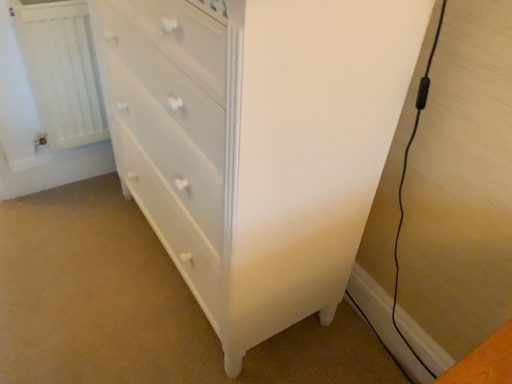
Question: Is white painted wood chest of drawers at center oriented away from white painted radiator at left?

Choices:
 (A) no
 (B) yes

Answer: (A)

Question: Could you tell me if white painted wood chest of drawers at center is turned towards white painted radiator at left?

Choices:
 (A) no
 (B) yes

Answer: (A)

Question: Can you confirm if white painted wood chest of drawers at center is smaller than white painted radiator at left?

Choices:
 (A) no
 (B) yes

Answer: (A)

Question: Does white painted wood chest of drawers at center appear on the right side of white painted radiator at left?

Choices:
 (A) no
 (B) yes

Answer: (B)

Question: Is white painted wood chest of drawers at center in contact with white painted radiator at left?

Choices:
 (A) no
 (B) yes

Answer: (A)

Question: Is white painted wood chest of drawers at center positioned behind white painted radiator at left?

Choices:
 (A) no
 (B) yes

Answer: (A)

Question: Considering the relative sizes of white painted radiator at left and white painted wood chest of drawers at center in the image provided, is white painted radiator at left smaller than white painted wood chest of drawers at center?

Choices:
 (A) no
 (B) yes

Answer: (B)

Question: Can you confirm if white painted radiator at left is thinner than white painted wood chest of drawers at center?

Choices:
 (A) no
 (B) yes

Answer: (B)

Question: Is white painted radiator at left at the left side of white painted wood chest of drawers at center?

Choices:
 (A) yes
 (B) no

Answer: (A)

Question: From a real-world perspective, is white painted radiator at left on white painted wood chest of drawers at center?

Choices:
 (A) yes
 (B) no

Answer: (B)

Question: Is white painted radiator at left positioned behind white painted wood chest of drawers at center?

Choices:
 (A) no
 (B) yes

Answer: (B)

Question: Is white painted radiator at left aimed at white painted wood chest of drawers at center?

Choices:
 (A) no
 (B) yes

Answer: (A)

Question: From a real-world perspective, is white painted wood chest of drawers at center physically located above or below white painted radiator at left?

Choices:
 (A) below
 (B) above

Answer: (B)